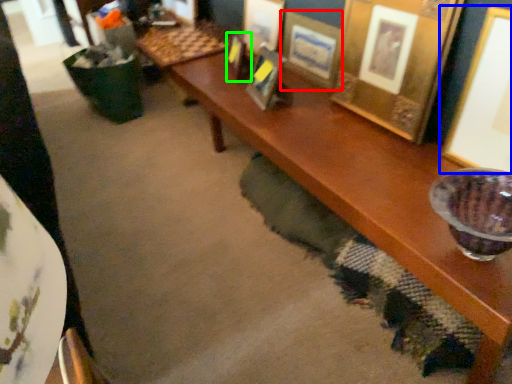
Question: Considering the real-world distances, which object is closest to picture frame (highlighted by a red box)? picture frame (highlighted by a blue box) or picture frame (highlighted by a green box).

Choices:
 (A) picture frame
 (B) picture frame

Answer: (B)